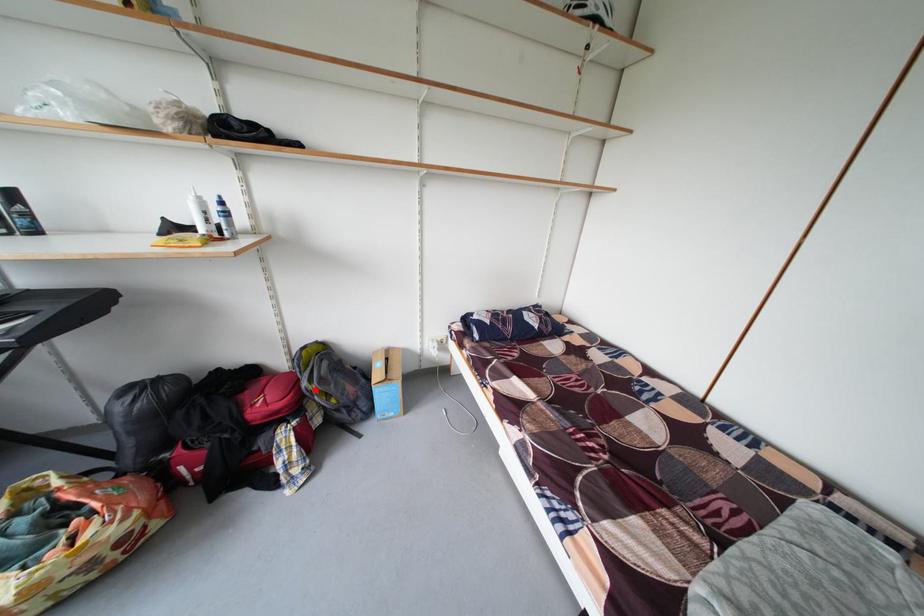
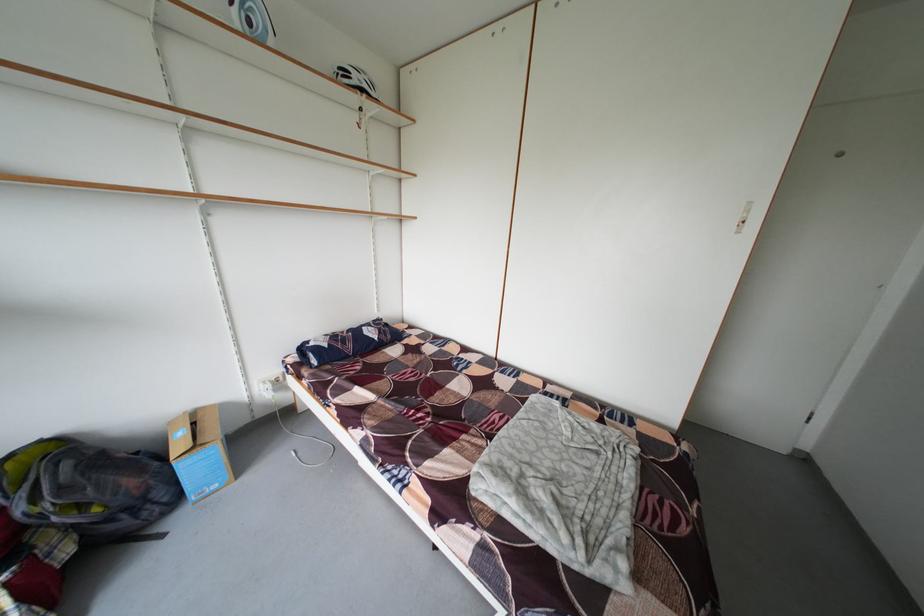
Find the pixel in the second image that matches the highlighted location in the first image.

(31, 515)